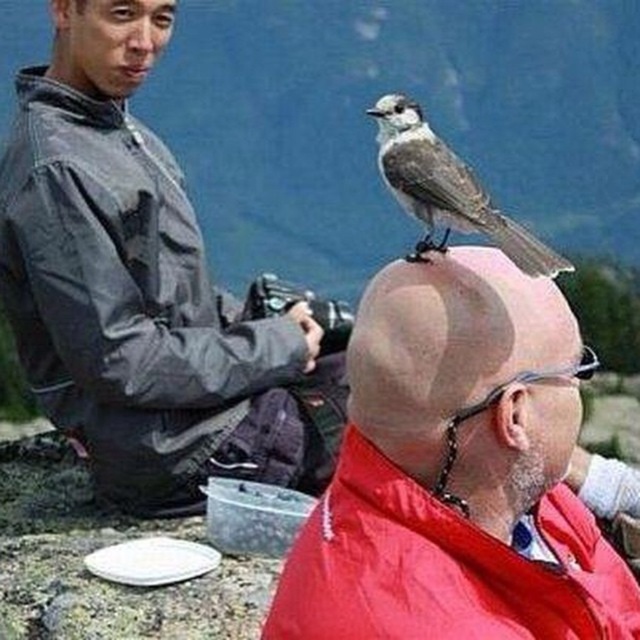
You are a photographer trying to capture the bird on the bald man. The camera is at position point (456, 472). Where should you aim the camera to get the bird in the frame?

The point (456, 472) is on the bald head at center, so aim the camera at the bald head at center to capture the bird.